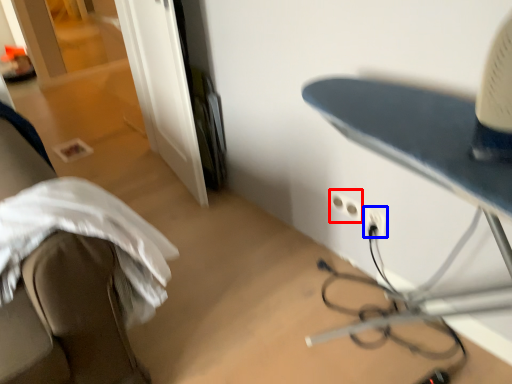
Question: Which point is closer to the camera, electric outlet (highlighted by a red box) or electric outlet (highlighted by a blue box)?

Choices:
 (A) electric outlet
 (B) electric outlet

Answer: (B)